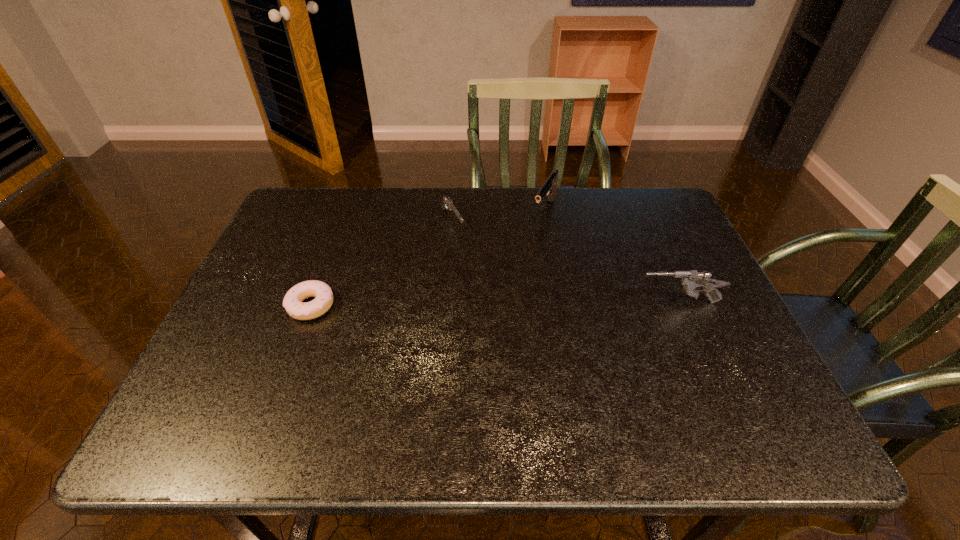
In the image, there is a desktop. At what (x,y) coordinates should I click in order to perform the action: click on vacant space at the near edge. Please return your answer as a coordinate pair (x, y). Looking at the image, I should click on (648, 391).

Where is `vacant space at the left edge of the desktop`? The width and height of the screenshot is (960, 540). vacant space at the left edge of the desktop is located at coordinates (300, 278).

At what (x,y) coordinates should I click in order to perform the action: click on vacant space at the right edge. Please return your answer as a coordinate pair (x, y). The height and width of the screenshot is (540, 960). Looking at the image, I should click on (751, 363).

The image size is (960, 540). I want to click on free space at the far left corner, so click(311, 231).

Locate an element on the screen. The height and width of the screenshot is (540, 960). free space between the right pistol and the gun is located at coordinates (612, 256).

Where is `vacant region between the doughnut and the shorter pistol`? The image size is (960, 540). vacant region between the doughnut and the shorter pistol is located at coordinates (382, 264).

The width and height of the screenshot is (960, 540). Find the location of `empty space between the shorter pistol and the gun`. empty space between the shorter pistol and the gun is located at coordinates coord(565,262).

Where is `vacant area that lies between the taller pistol and the gun`? The width and height of the screenshot is (960, 540). vacant area that lies between the taller pistol and the gun is located at coordinates (612, 256).

This screenshot has width=960, height=540. I want to click on vacant area that lies between the right pistol and the leftmost object, so click(428, 258).

The width and height of the screenshot is (960, 540). What are the coordinates of `vacant space that is in between the gun and the shorter pistol` in the screenshot? It's located at (565, 262).